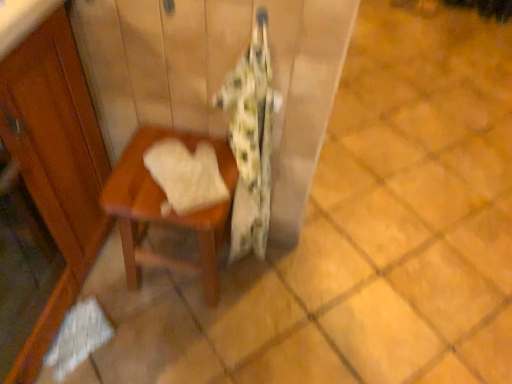
Locate an element on the screen. space that is in front of fluffy white blanket at center is located at coordinates (238, 317).